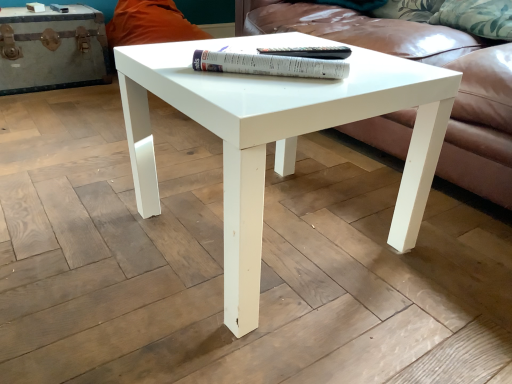
Where is `free space to the right of white glossy coffee table at center`? This screenshot has width=512, height=384. free space to the right of white glossy coffee table at center is located at coordinates (x=422, y=241).